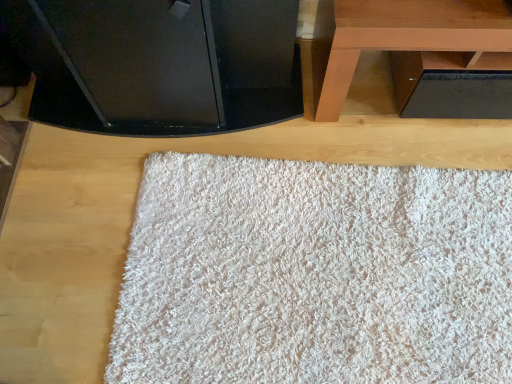
Find the location of a particular element. This screenshot has height=384, width=512. brown wooden table at upper right is located at coordinates (399, 38).

At what (x,y) coordinates should I click in order to perform the action: click on black glossy tv at upper center. Please return your answer as a coordinate pair (x, y). Looking at the image, I should click on (159, 64).

Is point (440, 200) closer or farther from the camera than point (419, 32)?

Point (440, 200) is positioned farther from the camera compared to point (419, 32).

In terms of width, does white fluffy rug at center look wider or thinner when compared to brown wooden table at upper right?

Clearly, white fluffy rug at center has more width compared to brown wooden table at upper right.

Between white fluffy rug at center and brown wooden table at upper right, which one appears on the left side from the viewer's perspective?

white fluffy rug at center.

Is white fluffy rug at center inside the boundaries of brown wooden table at upper right, or outside?

The correct answer is: outside.

From the image's perspective, does brown wooden table at upper right appear higher than white fluffy rug at center?

Correct, brown wooden table at upper right appears higher than white fluffy rug at center in the image.

At what (x,y) coordinates should I click in order to perform the action: click on mat on the left of the brown wooden table at upper right. Please return your answer as a coordinate pair (x, y). The image size is (512, 384). Looking at the image, I should click on (315, 274).

Is brown wooden table at upper right taller or shorter than white fluffy rug at center?

In the image, brown wooden table at upper right appears to be taller than white fluffy rug at center.

Can we say brown wooden table at upper right lies outside white fluffy rug at center?

Indeed, brown wooden table at upper right is completely outside white fluffy rug at center.

Between white fluffy rug at center and black glossy tv at upper center, which one has less height?

Standing shorter between the two is white fluffy rug at center.

Is point (244, 212) in front of point (188, 44)?

No.

From the picture: Would you say white fluffy rug at center is to the left or to the right of black glossy tv at upper center in the picture?

white fluffy rug at center is positioned on black glossy tv at upper center's right side.

How many degrees apart are the facing directions of white fluffy rug at center and black glossy tv at upper center?

The angular difference between white fluffy rug at center and black glossy tv at upper center is 178 degrees.

From a real-world perspective, is black glossy tv at upper center physically located above or below brown wooden table at upper right?

black glossy tv at upper center is situated higher than brown wooden table at upper right in the real world.

In the scene shown: Considering the relative positions of black glossy tv at upper center and brown wooden table at upper right in the image provided, is black glossy tv at upper center in front of brown wooden table at upper right?

Yes, the depth of black glossy tv at upper center is less than that of brown wooden table at upper right.

Is black glossy tv at upper center oriented away from brown wooden table at upper right?

No, black glossy tv at upper center is not facing the opposite direction of brown wooden table at upper right.

Find the location of a particular element. Image resolution: width=512 pixels, height=384 pixels. furniture above the brown wooden table at upper right (from a real-world perspective) is located at coordinates (159, 64).

From a real-world perspective, is brown wooden table at upper right located beneath black glossy tv at upper center?

Yes, from a real-world perspective, brown wooden table at upper right is under black glossy tv at upper center.

From the image's perspective, does brown wooden table at upper right appear lower than black glossy tv at upper center?

No, from the image's perspective, brown wooden table at upper right is not below black glossy tv at upper center.

How far apart are brown wooden table at upper right and black glossy tv at upper center?

brown wooden table at upper right and black glossy tv at upper center are 16.46 inches apart.

Where is `furniture above the white fluffy rug at center (from a real-world perspective)`? This screenshot has height=384, width=512. furniture above the white fluffy rug at center (from a real-world perspective) is located at coordinates (159, 64).

Would you consider black glossy tv at upper center to be distant from white fluffy rug at center?

No, black glossy tv at upper center is in close proximity to white fluffy rug at center.

Is black glossy tv at upper center not within white fluffy rug at center?

Absolutely, black glossy tv at upper center is external to white fluffy rug at center.

Identify the location of table above the white fluffy rug at center (from the image's perspective). pos(399,38).

Identify the location of table lying on the right of white fluffy rug at center. (399, 38).

Estimate the real-world distances between objects in this image. Which object is closer to white fluffy rug at center, black glossy tv at upper center or brown wooden table at upper right?

black glossy tv at upper center.

Looking at this image, based on their spatial positions, is brown wooden table at upper right or white fluffy rug at center further from black glossy tv at upper center?

white fluffy rug at center is further to black glossy tv at upper center.

Estimate the real-world distances between objects in this image. Which object is closer to white fluffy rug at center, brown wooden table at upper right or black glossy tv at upper center?

black glossy tv at upper center is closer to white fluffy rug at center.

Considering their positions, is white fluffy rug at center positioned further to black glossy tv at upper center than brown wooden table at upper right?

white fluffy rug at center.

When comparing their distances from brown wooden table at upper right, does white fluffy rug at center or black glossy tv at upper center seem further?

white fluffy rug at center.

When comparing their distances from brown wooden table at upper right, does black glossy tv at upper center or white fluffy rug at center seem further?

white fluffy rug at center is further to brown wooden table at upper right.

Find the location of a particular element. The height and width of the screenshot is (384, 512). mat situated between black glossy tv at upper center and brown wooden table at upper right from left to right is located at coordinates (315, 274).